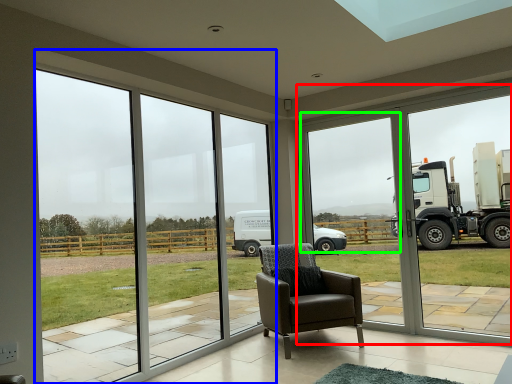
Question: Based on their relative distances, which object is farther from window frame (highlighted by a red box)? Choose from window (highlighted by a blue box) and window screen (highlighted by a green box).

Choices:
 (A) window
 (B) window screen

Answer: (A)